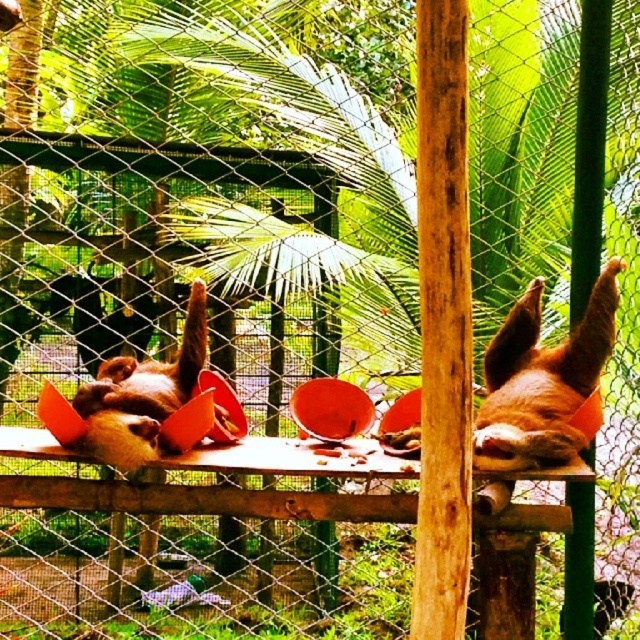
Can you confirm if brown furry sloth at right is shorter than brown furry sloth at center?

No.

Find the location of a particular element. The height and width of the screenshot is (640, 640). brown furry sloth at right is located at coordinates (541, 380).

Is point (492, 404) positioned after point (102, 362)?

No, (492, 404) is closer to viewer.

Find the location of a particular element. Image resolution: width=640 pixels, height=640 pixels. brown furry sloth at right is located at coordinates (541, 380).